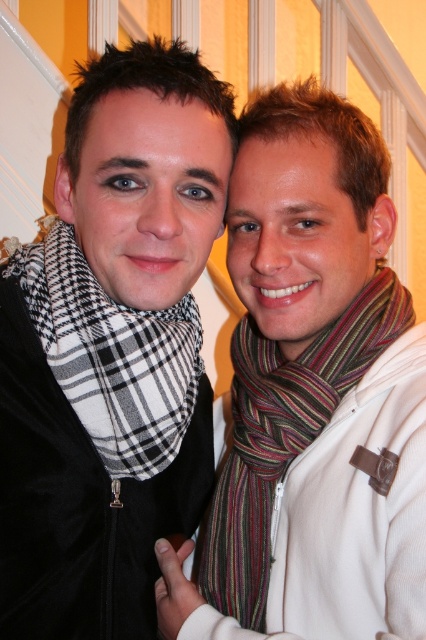
Question: Which point is closer to the camera?

Choices:
 (A) (377, 332)
 (B) (94, 333)

Answer: (B)

Question: Which object is farther from the camera taking this photo?

Choices:
 (A) striped wool scarf at right
 (B) black checkered scarf at left

Answer: (B)

Question: Is striped wool scarf at right wider than black checkered scarf at left?

Choices:
 (A) yes
 (B) no

Answer: (A)

Question: Does striped wool scarf at right appear on the right side of black checkered scarf at left?

Choices:
 (A) yes
 (B) no

Answer: (A)

Question: Where is striped wool scarf at right located in relation to black checkered scarf at left in the image?

Choices:
 (A) above
 (B) below

Answer: (B)